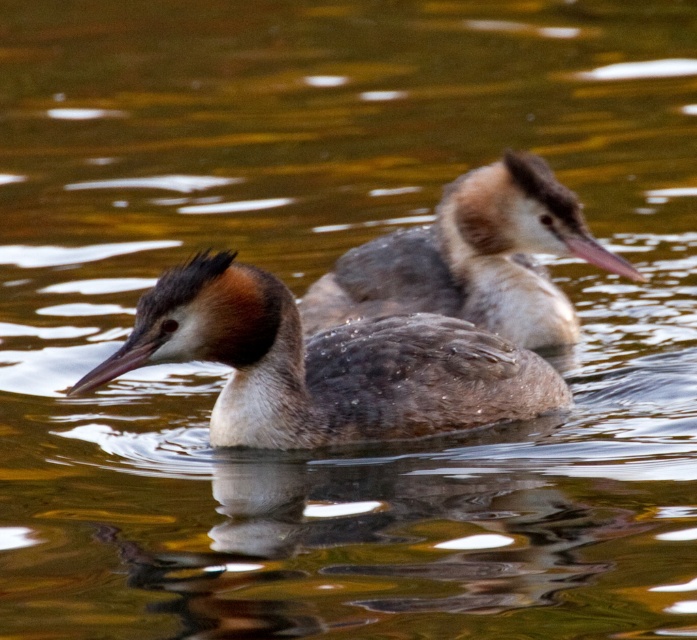
Between brown matte duck at left and brown matte duck at upper center, which one has more height?

brown matte duck at upper center is taller.

Between point (306, 369) and point (523, 157), which one is positioned in front?

Point (306, 369) is in front.

Image resolution: width=697 pixels, height=640 pixels. What are the coordinates of `brown matte duck at left` in the screenshot? It's located at (325, 364).